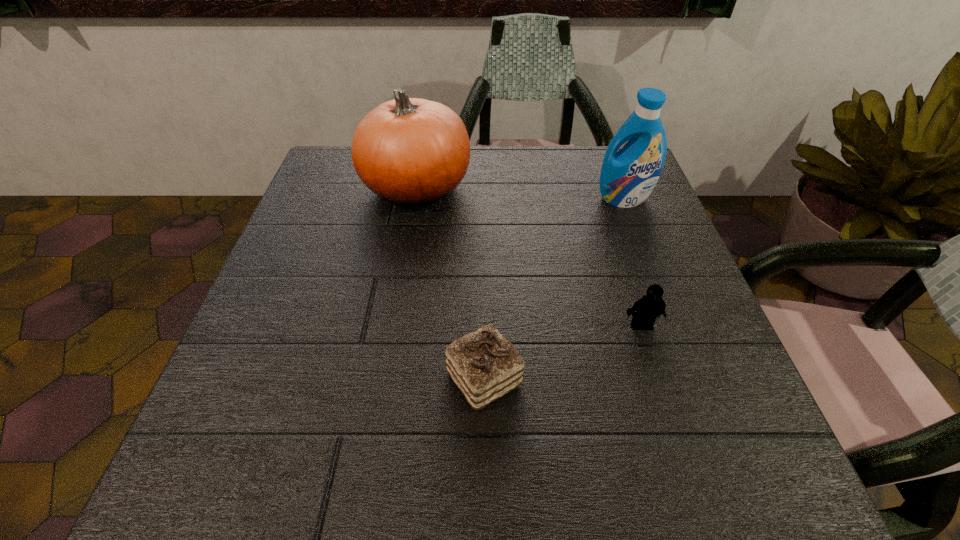
At what (x,y) coordinates should I click in order to perform the action: click on detergent at the far edge. Please return your answer as a coordinate pair (x, y). The height and width of the screenshot is (540, 960). Looking at the image, I should click on (628, 176).

Locate an element on the screen. pumpkin that is at the far edge is located at coordinates (413, 152).

Find the location of a particular element. This screenshot has height=540, width=960. object present at the left edge is located at coordinates (413, 152).

Find the location of a particular element. detergent that is at the right edge is located at coordinates (628, 176).

At what (x,y) coordinates should I click in order to perform the action: click on Lego at the right edge. Please return your answer as a coordinate pair (x, y). Looking at the image, I should click on (651, 305).

Where is `object present at the far left corner`? This screenshot has height=540, width=960. object present at the far left corner is located at coordinates (413, 152).

Identify the location of object present at the far right corner. (628, 176).

In the image, there is a desktop. Where is `blank space at the far edge`? blank space at the far edge is located at coordinates (548, 192).

The image size is (960, 540). In the image, there is a desktop. In order to click on blank space at the near edge in this screenshot , I will do `click(502, 448)`.

I want to click on free space at the left edge, so [363, 243].